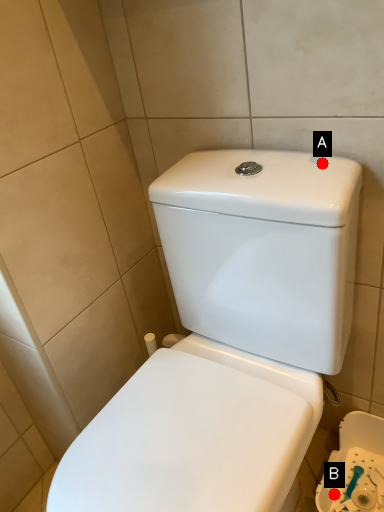
Question: Two points are circled on the image, labeled by A and B beside each circle. Among these points, which one is farthest from the camera?

Choices:
 (A) A is further
 (B) B is further

Answer: (B)